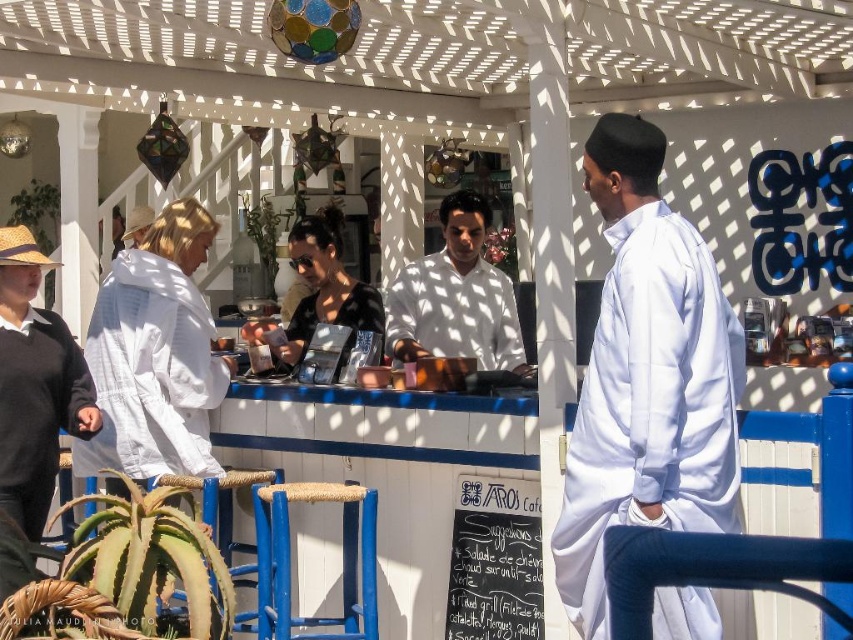
You are standing at the food stall counter and want to reach both the point at location (653, 440) and the point at (286, 493). Which point is physically closer to you?

The point at (653, 440) is closer to you because it is closer to the camera than the point at (286, 493).